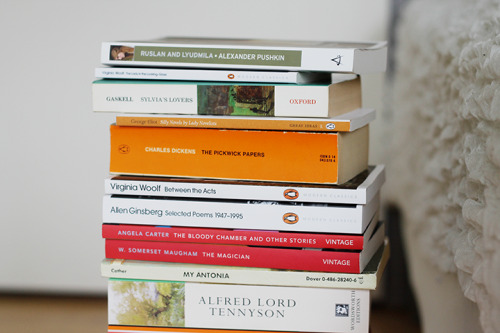
This screenshot has height=333, width=500. In order to click on books with a white spine in this screenshot , I will do `click(319, 57)`, `click(252, 75)`, `click(281, 105)`, `click(260, 193)`, `click(247, 216)`, `click(250, 277)`, `click(304, 311)`.